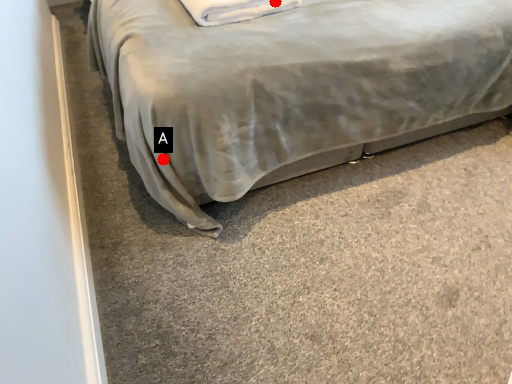
Question: Two points are circled on the image, labeled by A and B beside each circle. Which point is closer to the camera?

Choices:
 (A) A is closer
 (B) B is closer

Answer: (A)